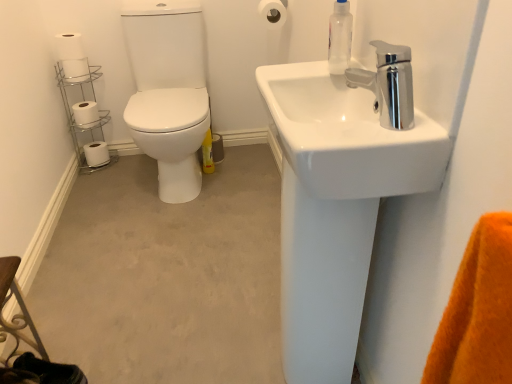
Where is `free space to the left of transparent plastic soap dispenser at upper right`? Image resolution: width=512 pixels, height=384 pixels. free space to the left of transparent plastic soap dispenser at upper right is located at coordinates (290, 67).